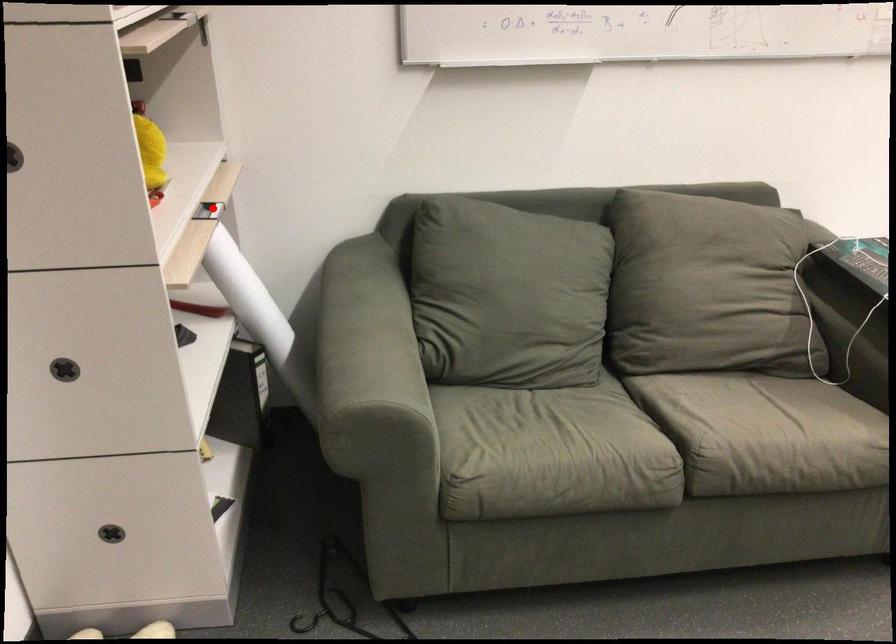
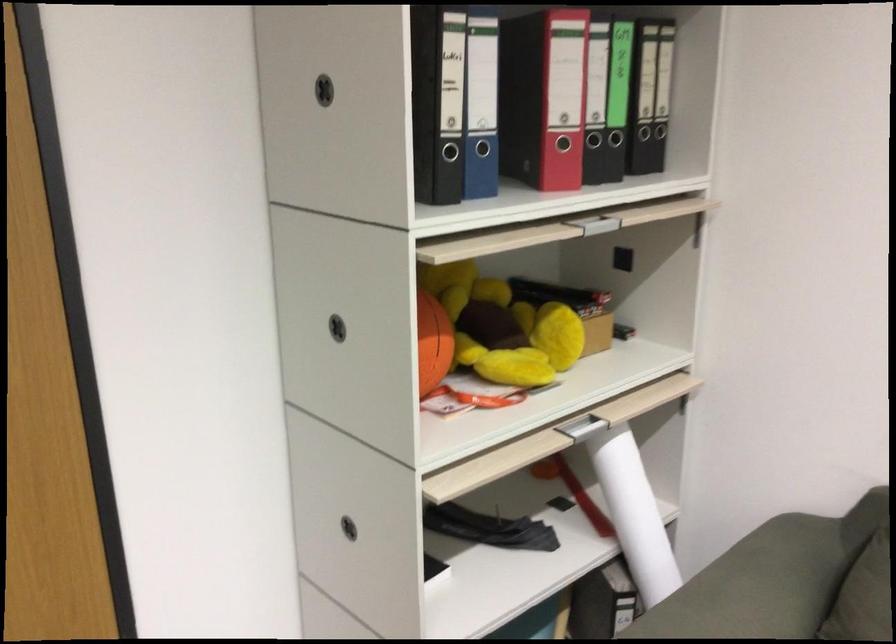
In the second image, find the point that corresponds to the highlighted location in the first image.

(595, 421)